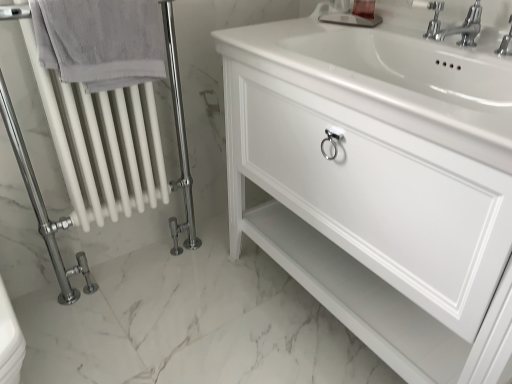
Find the location of a particular element. free space in front of white glossy radiator at left is located at coordinates (126, 339).